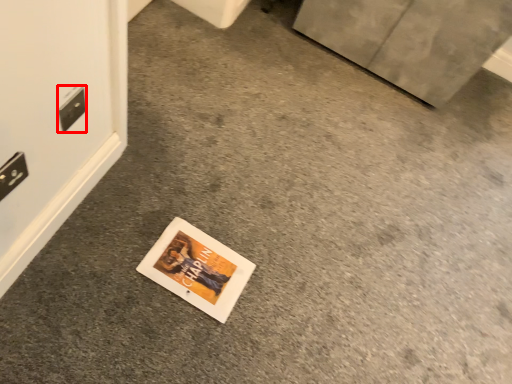
Question: From the image's perspective, where is electric outlet (annotated by the red box) located relative to electric outlet?

Choices:
 (A) below
 (B) above

Answer: (B)